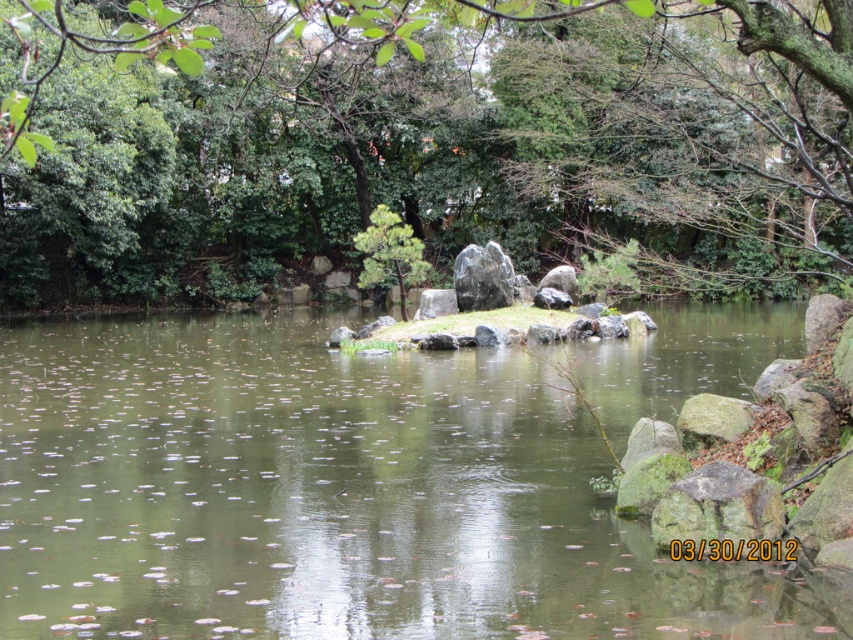
You are standing on the edge of the pond and want to reach the rough textured rock at lower right without stepping on any floating leaves. Which direction should you walk from the green leafy tree at center to avoid the leaves?

You should walk to the right from the green leafy tree at center towards the rough textured rock at lower right to avoid the floating leaves, as the tree is positioned to the left of the rock.

You are standing on the edge of the pond and see the green leafy tree at center and the green stone island at center. Which one is positioned to the right side of the other?

The green leafy tree at center is to the right of the green stone island at center.